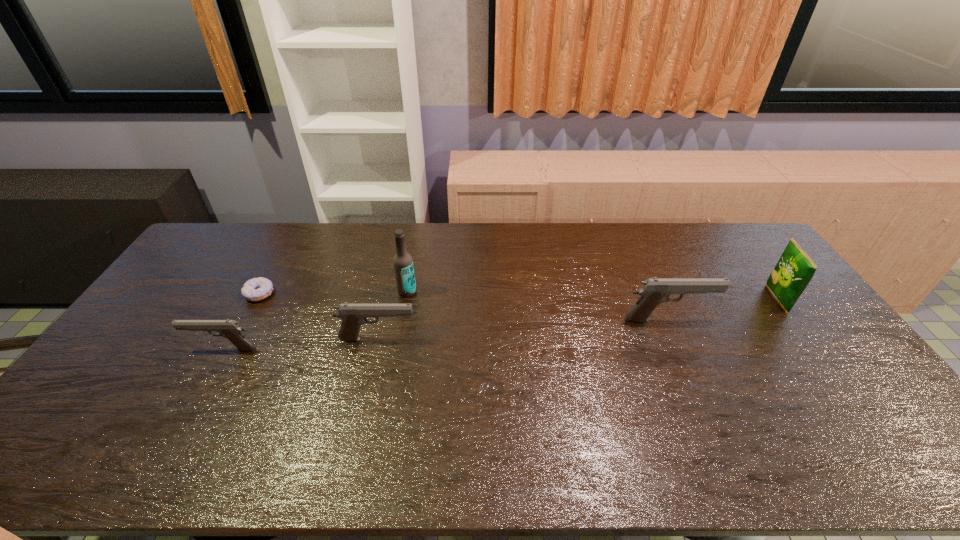
You are a GUI agent. You are given a task and a screenshot of the screen. Output one action in this format:
    pyautogui.click(x=<x>, y=<y>)
    Task: Click on the empty space between the shortest object and the shortest pistol
    This screenshot has height=540, width=960.
    Given the screenshot: What is the action you would take?
    pyautogui.click(x=241, y=321)

Image resolution: width=960 pixels, height=540 pixels. I want to click on vacant area that lies between the third nearest object and the shortest object, so click(x=464, y=307).

Find the location of a particular element. This screenshot has height=540, width=960. empty space between the nearest pistol and the doughnut is located at coordinates (241, 321).

Where is `object that is the third closest one to the tallest object`? The image size is (960, 540). object that is the third closest one to the tallest object is located at coordinates click(x=230, y=329).

Select which object is the second closest to the tallest object. Please provide its 2D coordinates. Your answer should be formatted as a tuple, i.e. [(x, y)], where the tuple contains the x and y coordinates of a point satisfying the conditions above.

[(256, 289)]

You are a GUI agent. You are given a task and a screenshot of the screen. Output one action in this format:
    pyautogui.click(x=<x>, y=<y>)
    Task: Click on the pistol that can be found as the second closest to the crisp (potato chip)
    The width and height of the screenshot is (960, 540).
    Given the screenshot: What is the action you would take?
    pyautogui.click(x=353, y=316)

Find the location of a particular element. This screenshot has height=540, width=960. pistol that is the second closest to the shortest pistol is located at coordinates (654, 291).

Find the location of `free space that satisfies the following two spatial constraints: 1. on the side of the tallest object with the label; 2. at the barrel of the nearest pistol`. free space that satisfies the following two spatial constraints: 1. on the side of the tallest object with the label; 2. at the barrel of the nearest pistol is located at coordinates (396, 349).